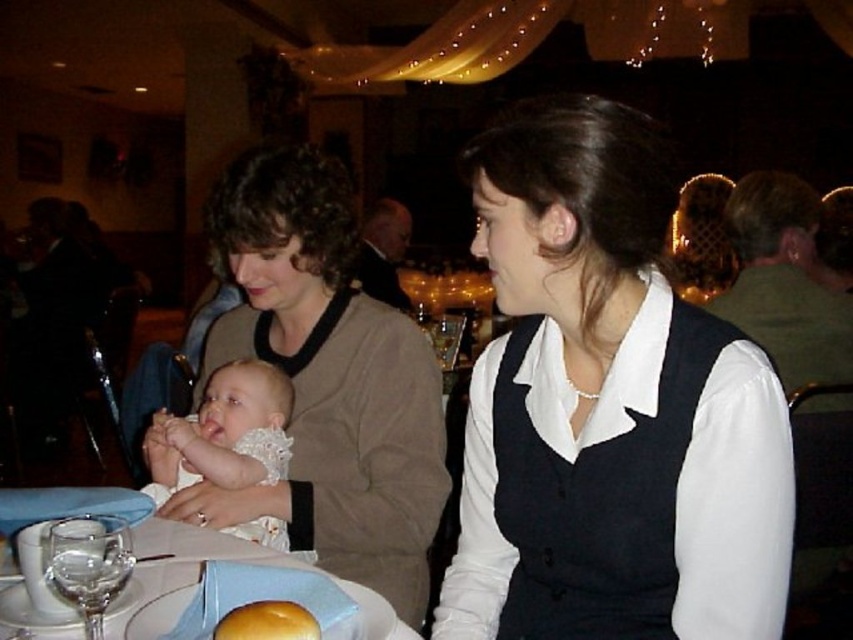
Is white matte vest at center below white lace baby at center?

No.

Who is more distant from viewer, (532, 620) or (241, 371)?

The point (241, 371) is more distant.

Locate an element on the screen. This screenshot has height=640, width=853. white matte vest at center is located at coordinates (608, 408).

Is white matte vest at center positioned at the back of golden matte bread at lower center?

Yes, white matte vest at center is further from the viewer.

Consider the image. Does white matte vest at center appear on the left side of golden matte bread at lower center?

No, white matte vest at center is not to the left of golden matte bread at lower center.

Image resolution: width=853 pixels, height=640 pixels. I want to click on white matte vest at center, so click(x=608, y=408).

This screenshot has width=853, height=640. Identify the location of white matte vest at center. (608, 408).

Is white porcelain plate at lower left to the right of clear glass wine glass at lower left from the viewer's perspective?

Indeed, white porcelain plate at lower left is positioned on the right side of clear glass wine glass at lower left.

Which of these two, white porcelain plate at lower left or clear glass wine glass at lower left, stands taller?

With more height is white porcelain plate at lower left.

Describe the element at coordinates (233, 588) in the screenshot. I see `white porcelain plate at lower left` at that location.

You are a GUI agent. You are given a task and a screenshot of the screen. Output one action in this format:
    pyautogui.click(x=<x>, y=<y>)
    Task: Click on the white porcelain plate at lower left
    This screenshot has width=853, height=640.
    Given the screenshot: What is the action you would take?
    pyautogui.click(x=233, y=588)